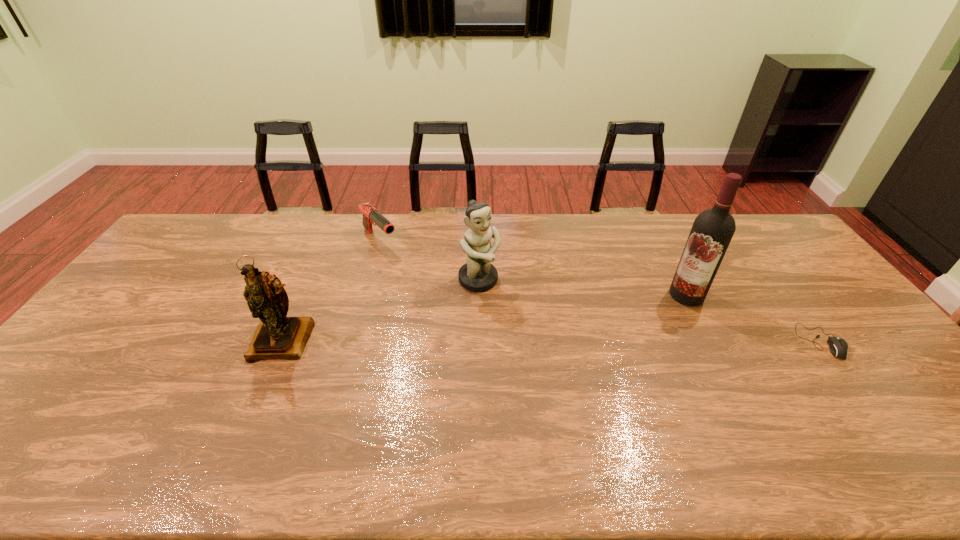
Find the location of `blank space located at the aiming end of the fourth tallest object`. blank space located at the aiming end of the fourth tallest object is located at coordinates (421, 282).

The image size is (960, 540). In order to click on object that is at the far edge in this screenshot , I will do `click(371, 215)`.

This screenshot has width=960, height=540. What are the coordinates of `object at the right edge` in the screenshot? It's located at (838, 347).

The width and height of the screenshot is (960, 540). In the image, there is a desktop. What are the coordinates of `vacant space at the far edge` in the screenshot? It's located at (611, 234).

Where is `vacant region at the near edge of the desktop`? The image size is (960, 540). vacant region at the near edge of the desktop is located at coordinates (464, 405).

The width and height of the screenshot is (960, 540). What are the coordinates of `vacant region at the left edge of the desktop` in the screenshot? It's located at (120, 308).

Where is `vacant area at the right edge`? vacant area at the right edge is located at coordinates (791, 262).

The width and height of the screenshot is (960, 540). Identify the location of free space between the farthest object and the left figurine. (332, 291).

Find the location of a particular element. The image size is (960, 540). vacant point located between the leftmost object and the wine bottle is located at coordinates (485, 318).

Where is `free space between the tallest object and the nearer figurine`? free space between the tallest object and the nearer figurine is located at coordinates (485, 318).